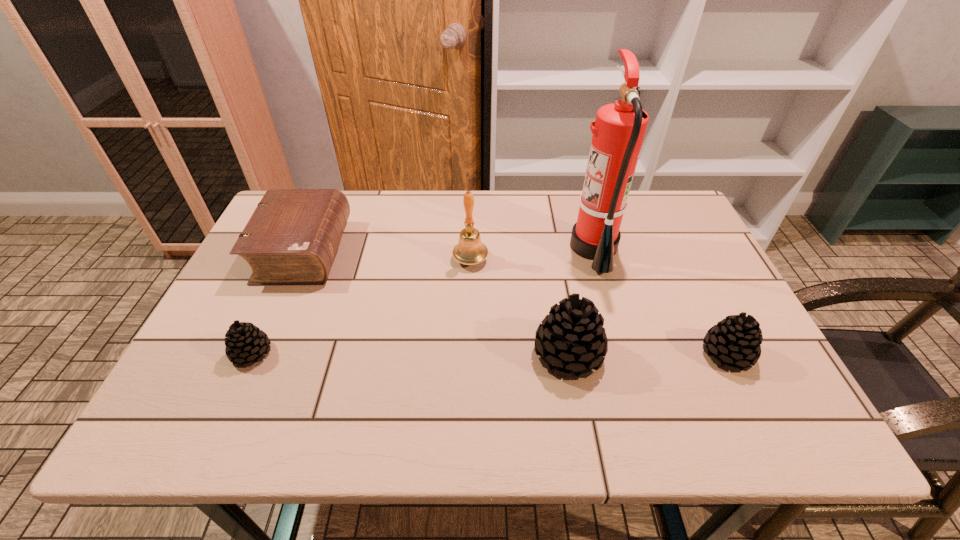
Where is `free space at the near edge of the desktop`? Image resolution: width=960 pixels, height=540 pixels. free space at the near edge of the desktop is located at coordinates (476, 363).

The image size is (960, 540). I want to click on vacant space at the right edge of the desktop, so click(684, 242).

Find the location of a particular element. blank space at the far right corner of the desktop is located at coordinates (639, 217).

The image size is (960, 540). Find the location of `vacant region between the tallest pinecone and the second tallest pinecone`. vacant region between the tallest pinecone and the second tallest pinecone is located at coordinates (648, 354).

Where is `vacant area that lies between the third object from left to right and the tallest object`? vacant area that lies between the third object from left to right and the tallest object is located at coordinates (532, 254).

The image size is (960, 540). Find the location of `free spot between the rightmost pinecone and the third object from left to right`. free spot between the rightmost pinecone and the third object from left to right is located at coordinates (599, 307).

Identify the location of free spot between the tallest object and the rightmost pinecone. This screenshot has height=540, width=960. (660, 301).

Locate an element on the screen. Image resolution: width=960 pixels, height=540 pixels. empty space between the second tallest pinecone and the Bible is located at coordinates (515, 302).

Locate an element on the screen. vacant point located between the second tallest object and the rightmost object is located at coordinates coord(599,307).

I want to click on unoccupied position between the second tallest object and the tallest object, so click(532, 254).